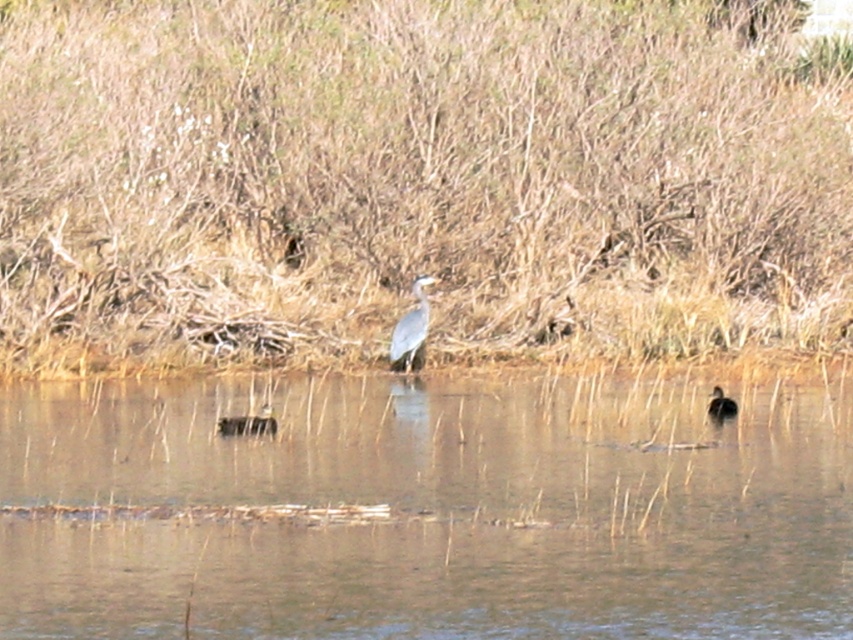
You are a small animal trying to cross from the brown dry grass at center to the brown matte water at center. The distance between them is 17.46 feet. If your maximum jumping distance is 10 feet, can you make the jump?

The distance between the brown dry grass at center and the brown matte water at center is 17.46 feet, which is greater than your maximum jumping distance of 10 feet. Therefore, you cannot make the jump.

You are a wildlife photographer observing the gray matte bird at center and the brown speckled duck at right in the wetland. Which bird would you need to adjust your camera focus to capture clearly if you want to photograph both in the same frame?

The gray matte bird at center is taller than the brown speckled duck at right. To capture both in the same frame, you would need to adjust your camera focus to account for the height difference, ensuring both are in focus.

You are a photographer aiming to capture the gray matte bird at center in the wetland scene. The camera is positioned at the point marked by coordinates point (410, 330). Will the bird be in the center of your photo?

Yes, the bird will be in the center of the photo because the point (410, 330) marks the gray matte bird at center, indicating it is positioned at the center of the image.